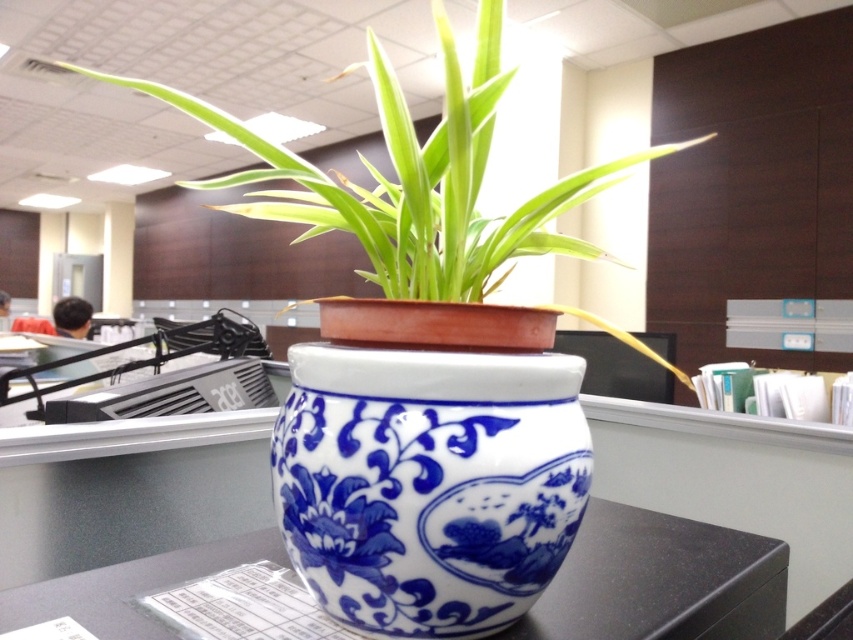
You are arranging a small figurine that is 10 cm tall on the white glossy table at center. You want to place it so that it is not hidden by the blue and white ceramic pot at center. Where should you place the figurine?

The blue and white ceramic pot at center is much taller than the white glossy table at center. To prevent the figurine from being hidden, place it on the edge of the white glossy table at center away from the blue and white ceramic pot at center.

You have a small decorative item that is 10 cm wide. You want to place it on the white glossy table at center so that it doesn not overlap with the blue porcelain vase at center. Is this possible?

The blue porcelain vase at center has a lesser width compared to white glossy table at center. Since the vase is narrower than the table, there should be enough space on the white glossy table at center to place the 10 cm wide decorative item without overlapping, provided it is positioned appropriately around the vase.

You are a florist arranging flowers and need to choose between the blue porcelain vase at center and the blue and white ceramic pot at center for a bouquet that requires a taller container. Which one should you choose?

The blue and white ceramic pot at center is taller than the blue porcelain vase at center, so you should choose the blue and white ceramic pot at center for the bouquet that requires a taller container.